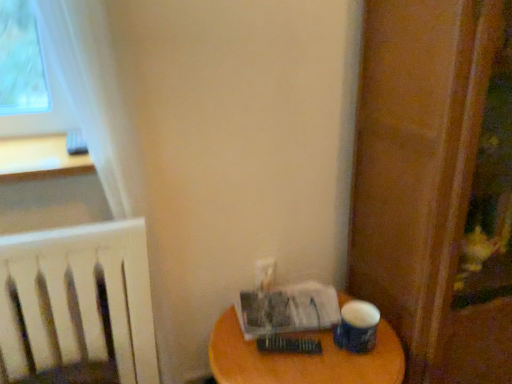
Question: Is blue matte paper cup at lower right in front of or behind wooden screen door at right in the image?

Choices:
 (A) front
 (B) behind

Answer: (B)

Question: Visually, is blue matte paper cup at lower right positioned to the left or to the right of wooden screen door at right?

Choices:
 (A) right
 (B) left

Answer: (B)

Question: Estimate the real-world distances between objects in this image. Which object is closer to the wooden table at lower right?

Choices:
 (A) wooden screen door at right
 (B) blue matte paper cup at lower right
 (C) white paper at lower right, arranged as the 2th paperback book when viewed from the front
 (D) hardcover book at center, marked as the first paperback book in a front-to-back arrangement

Answer: (C)

Question: Which object is the closest to the blue matte paper cup at lower right?

Choices:
 (A) white paper at lower right, arranged as the 2th paperback book when viewed from the front
 (B) wooden screen door at right
 (C) hardcover book at center, marked as the first paperback book in a front-to-back arrangement
 (D) wooden table at lower right

Answer: (C)